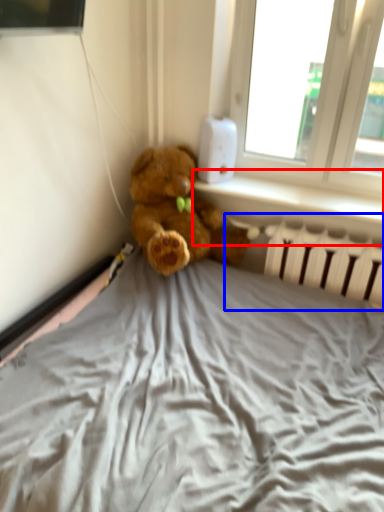
Question: Which of the following is the farthest to the observer, window sill (highlighted by a red box) or radiator (highlighted by a blue box)?

Choices:
 (A) window sill
 (B) radiator

Answer: (A)